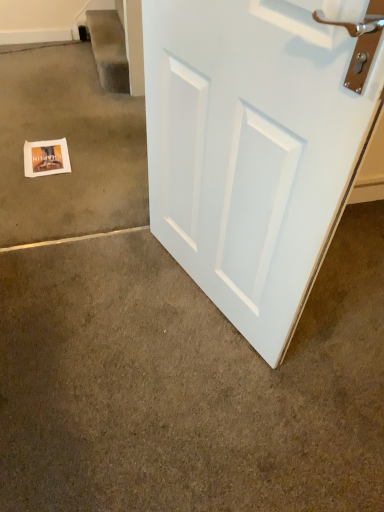
Image resolution: width=384 pixels, height=512 pixels. Identify the location of vacant area that lies in front of white matte door at right. (198, 399).